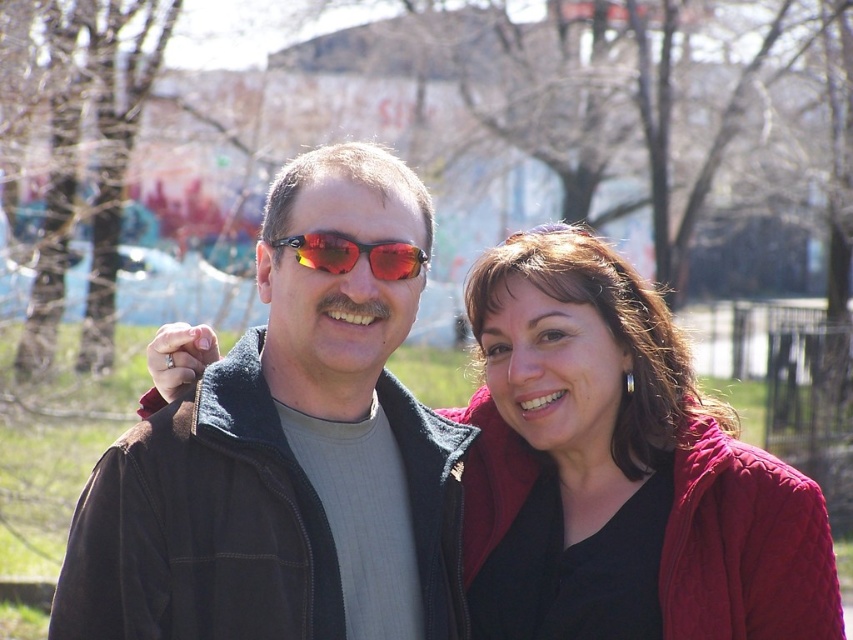
Question: Estimate the real-world distances between objects in this image. Which object is farther from the red reflective lens sunglasses at center?

Choices:
 (A) matte black jacket at center
 (B) corduroy red jacket at center

Answer: (B)

Question: Which of the following is the farthest from the observer?

Choices:
 (A) matte black jacket at center
 (B) red reflective lens sunglasses at center

Answer: (B)

Question: Is matte black jacket at center thinner than corduroy red jacket at center?

Choices:
 (A) no
 (B) yes

Answer: (B)

Question: Where is matte black jacket at center located in relation to corduroy red jacket at center in the image?

Choices:
 (A) right
 (B) left

Answer: (B)

Question: Where is corduroy red jacket at center located in relation to red reflective lens sunglasses at center in the image?

Choices:
 (A) above
 (B) below

Answer: (B)

Question: Which of the following is the farthest from the observer?

Choices:
 (A) corduroy red jacket at center
 (B) red reflective lens sunglasses at center

Answer: (A)